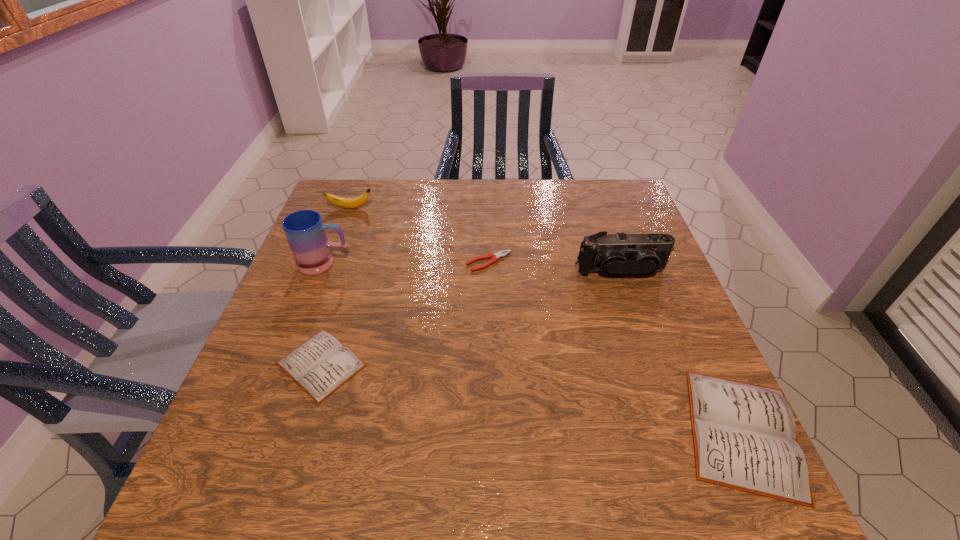
Find the location of `empty space between the shortest object and the mug`. empty space between the shortest object and the mug is located at coordinates (407, 263).

At what (x,y) coordinates should I click in order to perform the action: click on vacant point located between the camcorder and the fifth tallest object. Please return your answer as a coordinate pair (x, y). Image resolution: width=960 pixels, height=540 pixels. Looking at the image, I should click on (471, 318).

You are a GUI agent. You are given a task and a screenshot of the screen. Output one action in this format:
    pyautogui.click(x=<x>, y=<y>)
    Task: Click on the free point between the tallest object and the fourth object from left to right
    
    Given the screenshot: What is the action you would take?
    pyautogui.click(x=407, y=263)

The width and height of the screenshot is (960, 540). I want to click on free space between the pliers and the tallest object, so click(407, 263).

Find the location of a particular element. The image size is (960, 540). empty space that is in between the taller diary and the second tallest object is located at coordinates (682, 352).

Where is `free space between the taller diary and the pliers`? This screenshot has height=540, width=960. free space between the taller diary and the pliers is located at coordinates (615, 347).

In order to click on vacant area that lies between the third shortest object and the fifth tallest object in this screenshot , I will do `click(532, 398)`.

Identify the location of free space between the third tallest object and the pliers. Image resolution: width=960 pixels, height=540 pixels. (420, 235).

The height and width of the screenshot is (540, 960). What are the coordinates of `free space between the second shortest object and the third shortest object` in the screenshot? It's located at (532, 398).

Locate an element on the screen. object that is the third closest to the shorter diary is located at coordinates (349, 203).